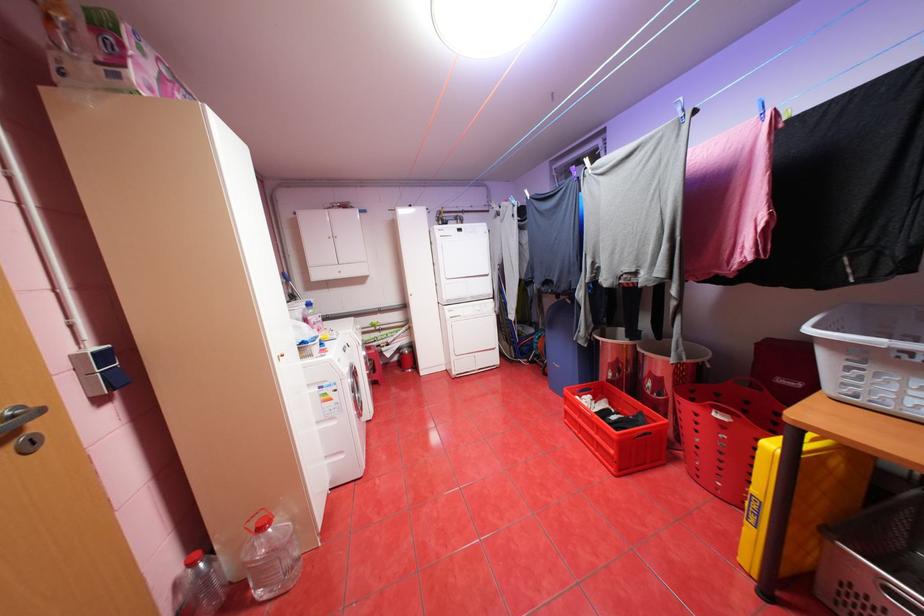
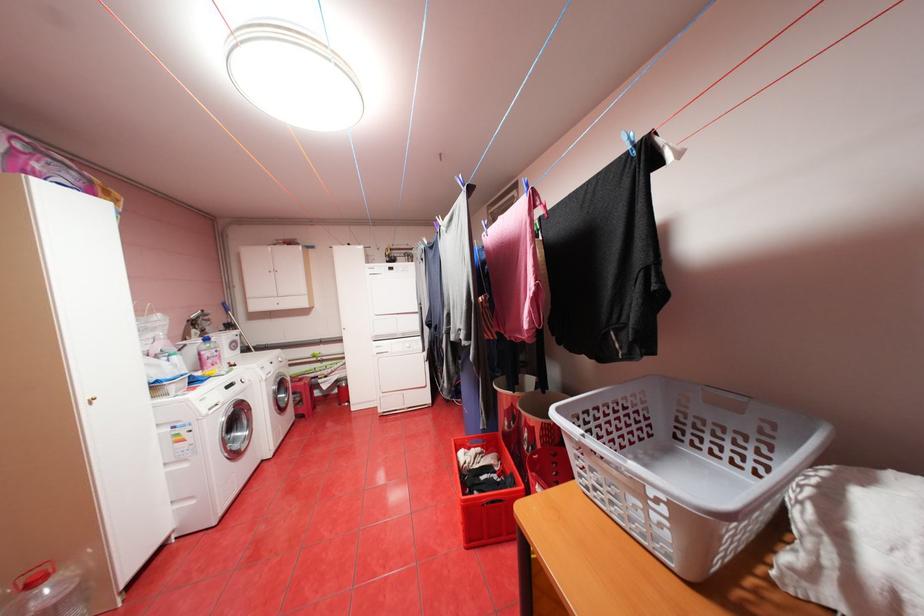
Where in the second image is the point corresponding to pixel 599 395 from the first image?

(488, 448)